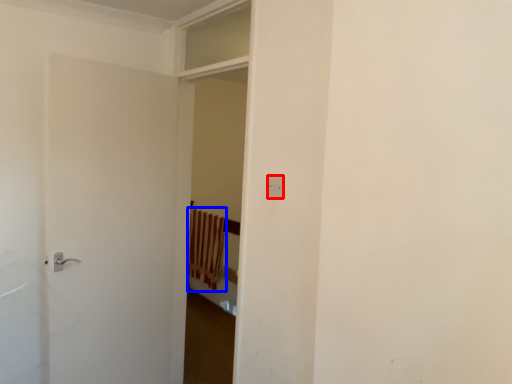
Question: Which object is further to the camera taking this photo, electric outlet (highlighted by a red box) or curtain (highlighted by a blue box)?

Choices:
 (A) electric outlet
 (B) curtain

Answer: (B)